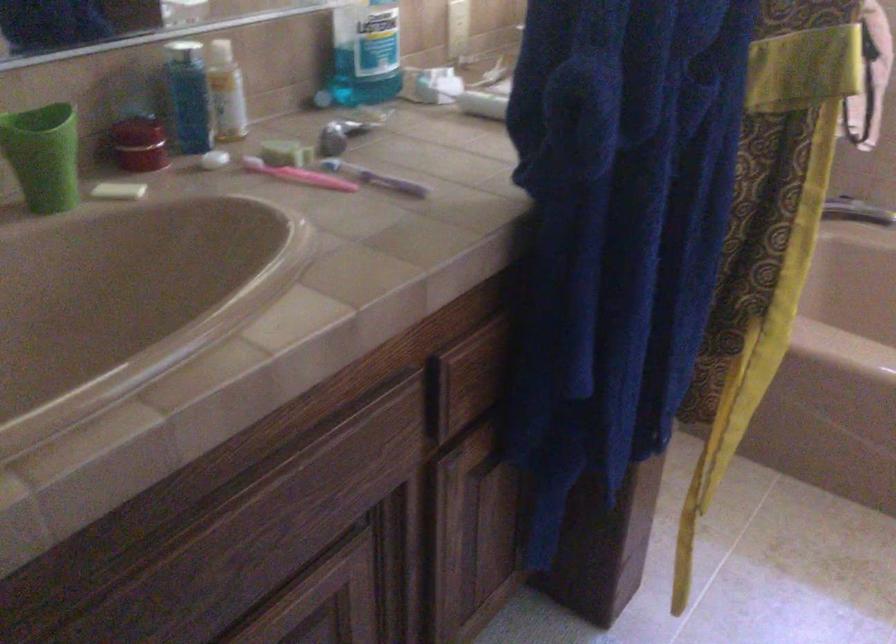
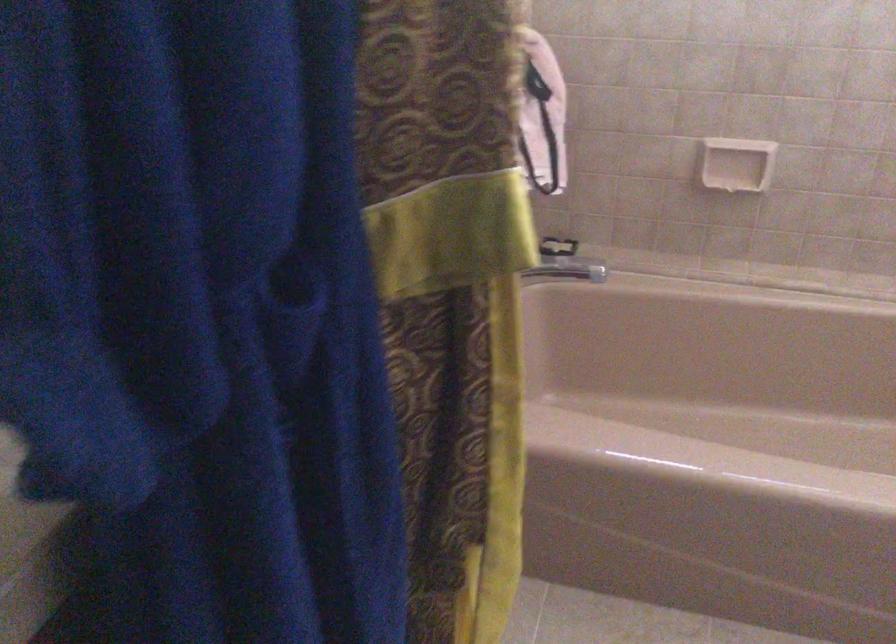
Question: The camera is either moving clockwise (left) or counter-clockwise (right) around the object. The first image is from the beginning of the video and the second image is from the end. Is the camera moving left or right when shooting the video?

Choices:
 (A) Left
 (B) Right

Answer: (A)